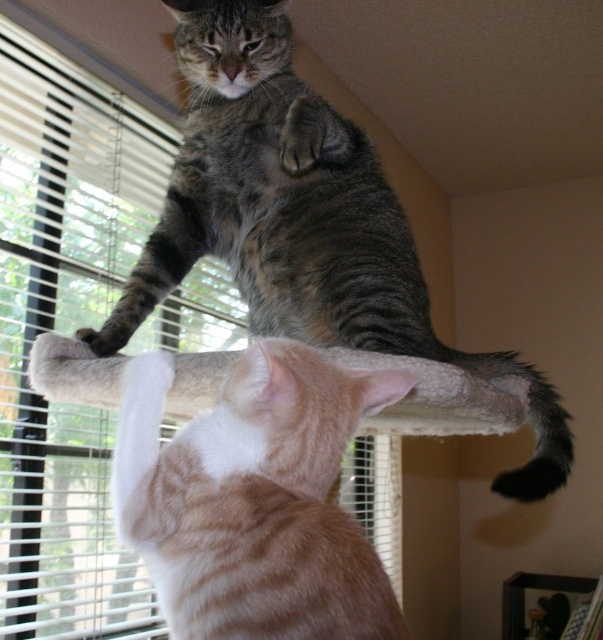
Is gray tabby cat at upper center further to the viewer compared to orange tabby cat at upper center?

Yes.

Where is `gray tabby cat at upper center`? The width and height of the screenshot is (603, 640). gray tabby cat at upper center is located at coordinates (300, 220).